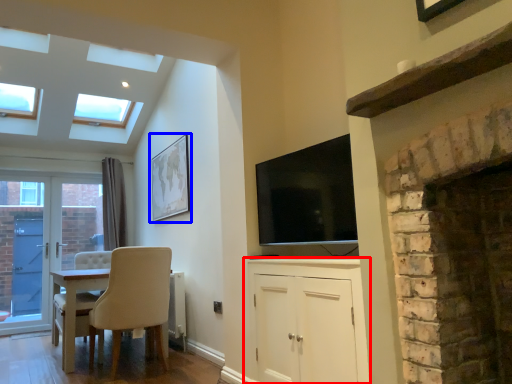
Question: Which point is closer to the camera, cabinetry (highlighted by a red box) or picture frame (highlighted by a blue box)?

Choices:
 (A) cabinetry
 (B) picture frame

Answer: (A)